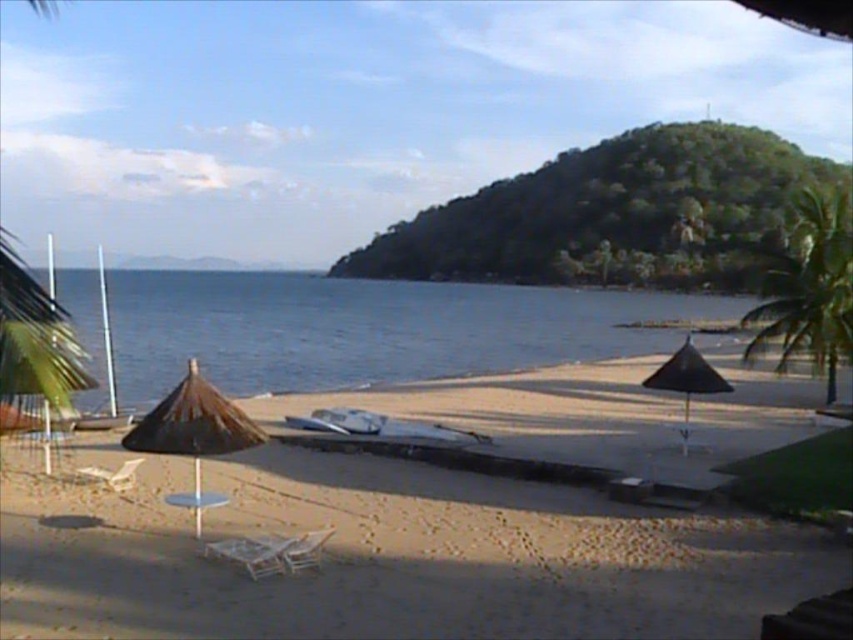
Question: Is blue water at center wider than white plastic beach chair at lower left?

Choices:
 (A) no
 (B) yes

Answer: (B)

Question: Among these points, which one is nearest to the camera?

Choices:
 (A) (235, 340)
 (B) (131, 472)
 (C) (300, 540)

Answer: (C)

Question: Can you confirm if beige sand at center is positioned to the right of wooden beach chair at lower left?

Choices:
 (A) yes
 (B) no

Answer: (A)

Question: Which object appears farthest from the camera in this image?

Choices:
 (A) brown woven umbrella at left
 (B) wooden beach chair at center

Answer: (B)

Question: Which point appears closest to the camera in this image?

Choices:
 (A) (209, 356)
 (B) (225, 442)
 (C) (33, 515)

Answer: (B)

Question: Considering the relative positions of wooden beach chair at center and white plastic beach chair at lower left in the image provided, where is wooden beach chair at center located with respect to white plastic beach chair at lower left?

Choices:
 (A) below
 (B) above

Answer: (A)